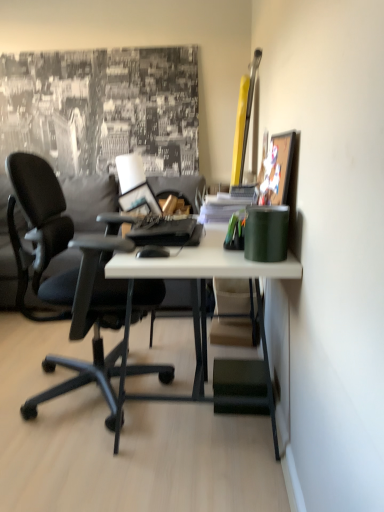
The height and width of the screenshot is (512, 384). I want to click on free space to the left of green plastic pen holder at center, the first stationery when ordered from back to front, so click(192, 251).